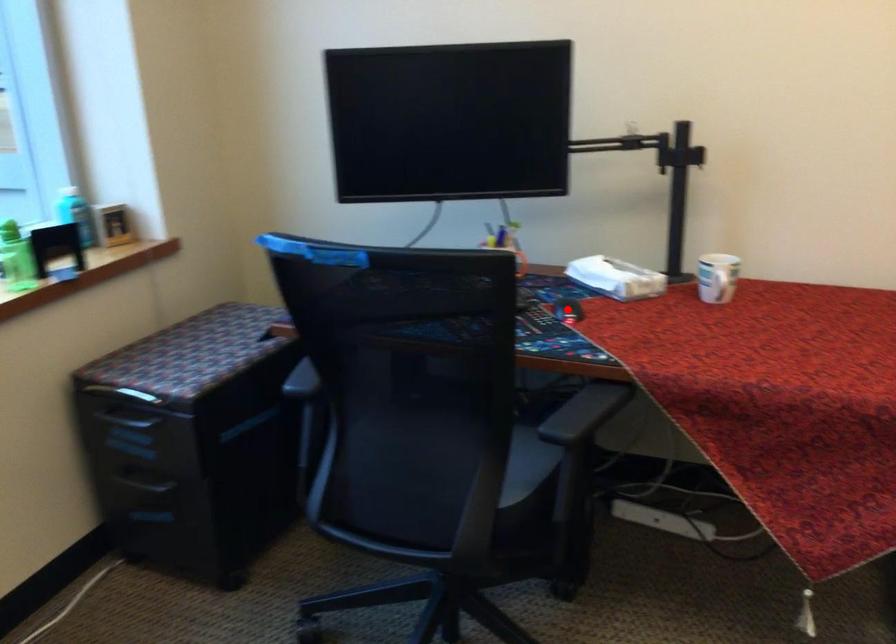
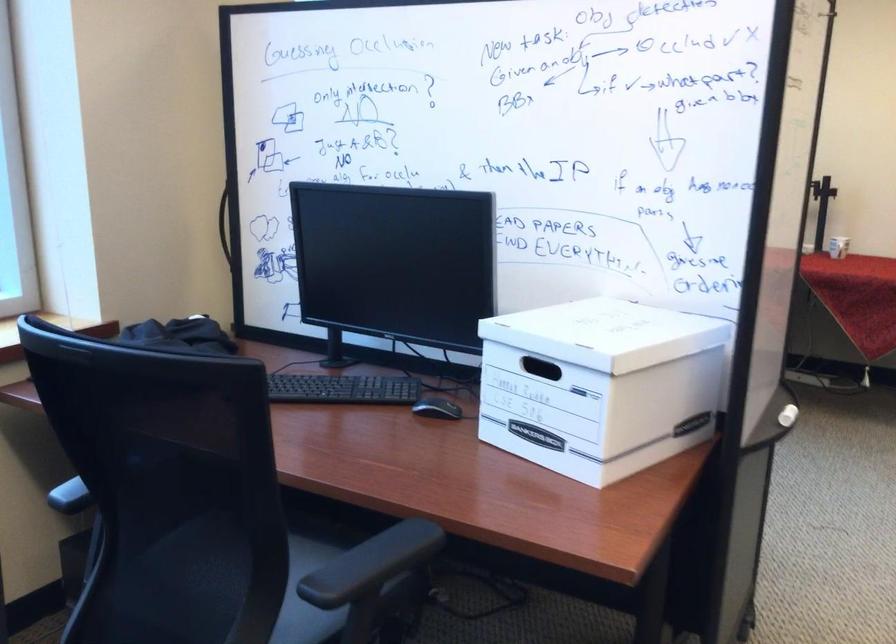
Question: I am providing you with two images of the same scene from different viewpoints. A red point is marked on the first image. Can you still see the location of the red point in image 2?

Choices:
 (A) Yes
 (B) No

Answer: (B)